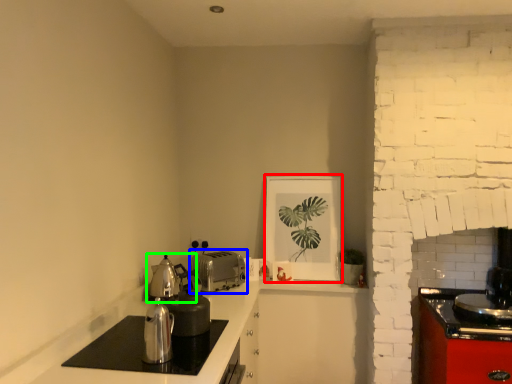
Question: Which object is the closest to the picture frame (highlighted by a red box)? Choose among these: toaster (highlighted by a blue box) or tea pot (highlighted by a green box).

Choices:
 (A) toaster
 (B) tea pot

Answer: (A)